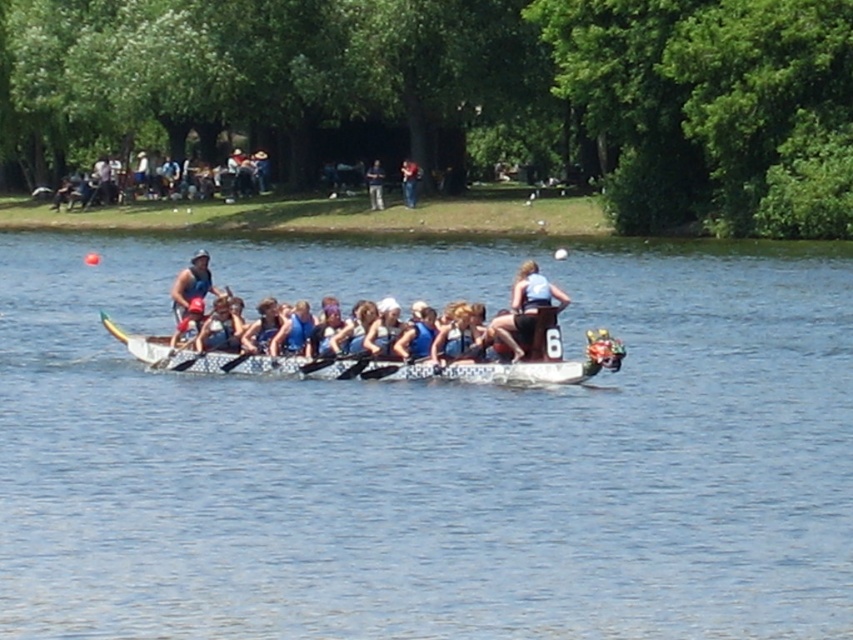
You are a photographer standing at the starting line of the dragon boat race. You want to capture a closeup shot of the blue fabric boat at upper center. Given that your telephoto lens can focus on objects up to 80 meters away, will you be able to take a clear photo?

The blue fabric boat at upper center is 82.67 meters away from the camera. Since the telephoto lens can only focus up to 80 meters, you won let the boat be within the focus range. Therefore, you won let take a clear photo.

You are a photographer trying to capture the dragon boat race. You notice the blue fabric boat at upper center and the matte blue tank top at center. Which object would you need to focus on first if you want to take a photo that includes both objects without moving the camera?

The blue fabric boat at upper center is wider than the matte blue tank top at center, so you should focus on the blue fabric boat at upper center first to ensure it fits in the frame before adjusting for the smaller matte blue tank top at center.